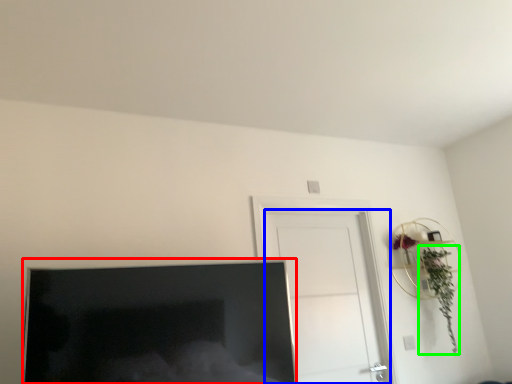
Question: Which object is positioned closest to television (highlighted by a red box)? Select from door (highlighted by a blue box) and plant (highlighted by a green box).

Choices:
 (A) door
 (B) plant

Answer: (A)